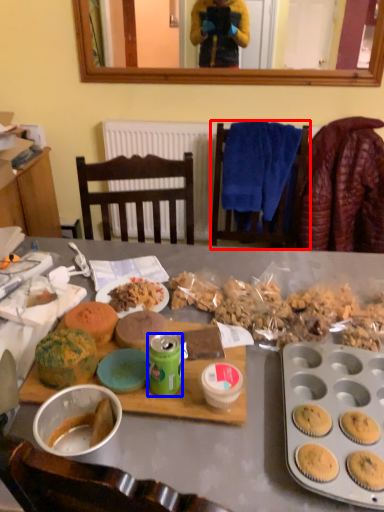
Question: Among these objects, which one is farthest to the camera, chair (highlighted by a red box) or coffee cup (highlighted by a blue box)?

Choices:
 (A) chair
 (B) coffee cup

Answer: (A)